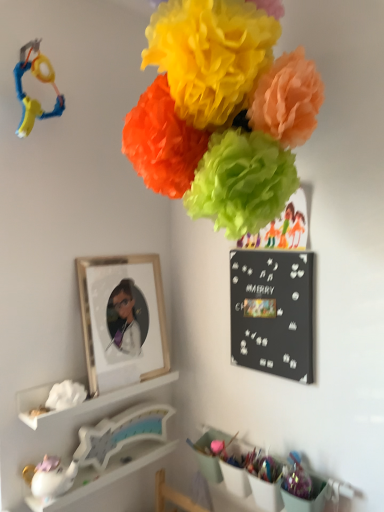
Question: Considering the positions of white fluffy tissue at lower left, placed as the 2th flower when sorted from front to back, and white matte tissue box at lower left, the 3th shelf positioned from the bottom, in the image, is white fluffy tissue at lower left, placed as the 2th flower when sorted from front to back, bigger or smaller than white matte tissue box at lower left, the 3th shelf positioned from the bottom,?

Choices:
 (A) big
 (B) small

Answer: (B)

Question: Based on their positions, is white fluffy tissue at lower left, the 1th flower when ordered from left to right, located to the left or right of white matte tissue box at lower left, acting as the 1th shelf starting from the top?

Choices:
 (A) left
 (B) right

Answer: (A)

Question: Which object is positioned farthest from the black matte bulletin board at upper right?

Choices:
 (A) white glossy unicorn at lower left, which is the first toy in bottom-to-top order
 (B) white glossy unicorn at lower left, which is the 1th shelf from bottom to top
 (C) wooden picture frame at lower left
 (D) matte plastic bags at lower center, the second shelf in the bottom-to-top sequence
 (E) matte tissue paper flowers at upper center, placed as the first flower when sorted from top to bottom

Answer: (A)

Question: Which object is the farthest from the white glossy unicorn at lower left, which is the 1th shelf from bottom to top?

Choices:
 (A) white fluffy tissue at lower left, placed as the 2th flower when sorted from front to back
 (B) matte tissue paper flowers at upper center, which is the 1th flower from front to back
 (C) black matte bulletin board at upper right
 (D) white matte tissue box at lower left, acting as the 1th shelf starting from the top
 (E) white glossy unicorn at lower left, which is the second toy in top-to-bottom order

Answer: (B)